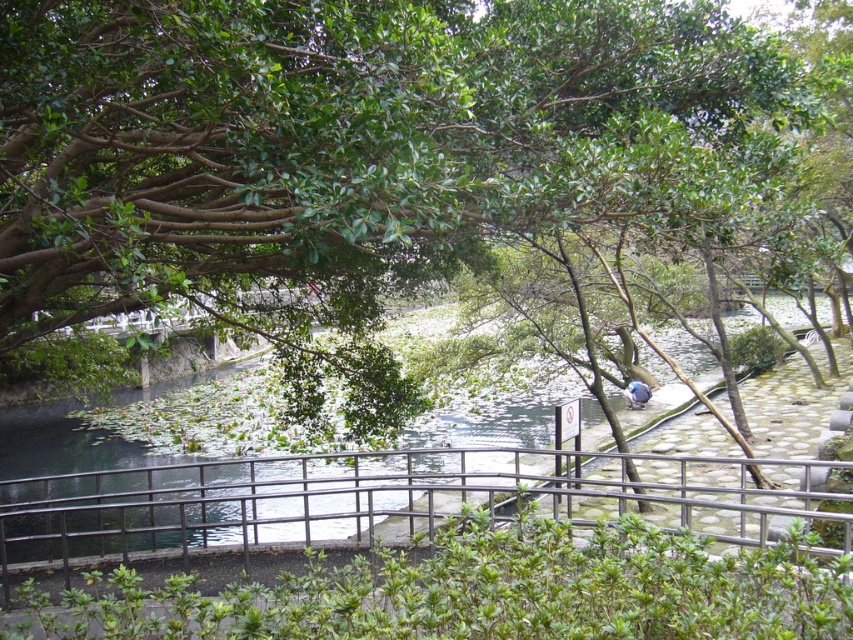
Question: Which point is farther from the camera taking this photo?

Choices:
 (A) (671, 6)
 (B) (276, 472)

Answer: (B)

Question: Which of the following is the closest to the observer?

Choices:
 (A) metallic gray railing at center
 (B) green leafy tree at upper center

Answer: (B)

Question: Does green leafy tree at upper center lie behind metallic gray railing at center?

Choices:
 (A) yes
 (B) no

Answer: (B)

Question: Does green leafy tree at upper center appear on the left side of metallic gray railing at center?

Choices:
 (A) yes
 (B) no

Answer: (A)

Question: Which point appears farthest from the camera in this image?

Choices:
 (A) (740, 68)
 (B) (460, 492)

Answer: (B)

Question: Considering the relative positions of green leafy tree at upper center and metallic gray railing at center in the image provided, where is green leafy tree at upper center located with respect to metallic gray railing at center?

Choices:
 (A) above
 (B) below

Answer: (A)